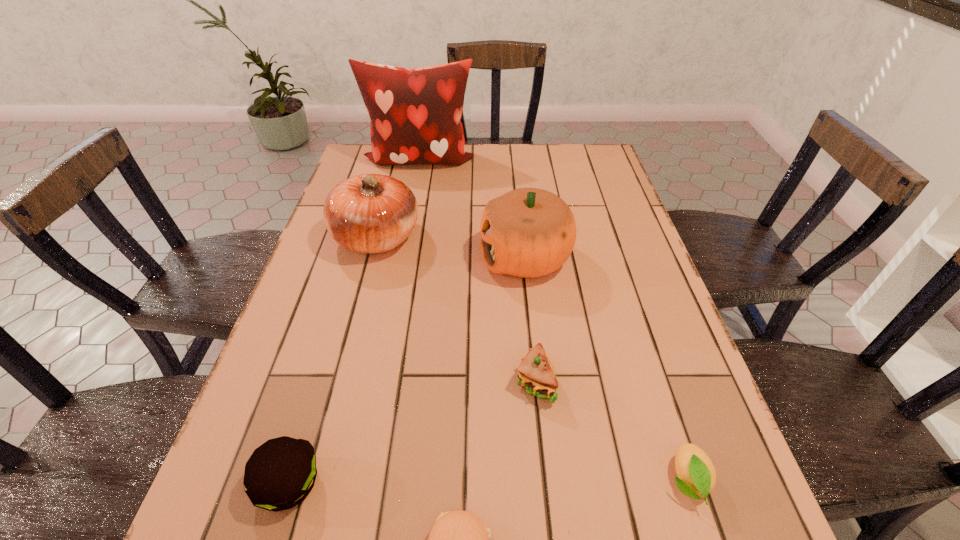
In order to click on object at the far left corner in this screenshot , I will do `click(415, 114)`.

Image resolution: width=960 pixels, height=540 pixels. Identify the location of free spot at the far edge of the desktop. (462, 177).

The width and height of the screenshot is (960, 540). Identify the location of vacant space at the left edge of the desktop. (306, 300).

The image size is (960, 540). Find the location of `vacant space at the right edge`. vacant space at the right edge is located at coordinates coord(630,212).

The height and width of the screenshot is (540, 960). What are the coordinates of `vacant space at the far right corner of the desktop` in the screenshot? It's located at (568, 149).

The width and height of the screenshot is (960, 540). I want to click on free space between the right pumpkin and the fourth nearest object, so point(530,320).

Locate an element on the screen. free space between the taller patty and the sixth tallest object is located at coordinates (489, 482).

The height and width of the screenshot is (540, 960). I want to click on free space that is in between the farthest object and the fourth farthest object, so click(x=477, y=271).

Identify the location of unoccupied area between the left patty and the left pumpkin. (333, 361).

Locate an element on the screen. This screenshot has width=960, height=540. vacant region between the right pumpkin and the taller patty is located at coordinates (407, 371).